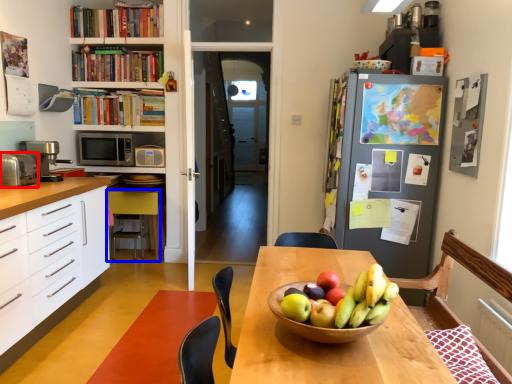
Question: Which point is closer to the camera, appliance (highlighted by a red box) or chair (highlighted by a blue box)?

Choices:
 (A) appliance
 (B) chair

Answer: (A)